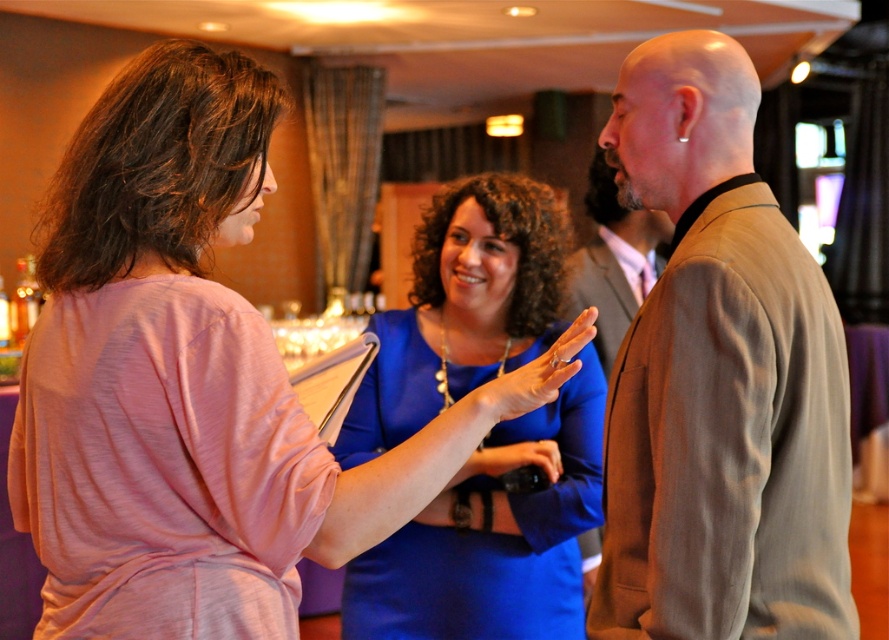
Who is shorter, matte pink hand at center or matte black camera at center?

With less height is matte black camera at center.

Which is more to the left, matte pink hand at center or matte black camera at center?

matte pink hand at center

Identify the location of matte pink hand at center. (535, 376).

Which is behind, point (714, 230) or point (527, 456)?

The point (527, 456) is more distant.

Is light brown jacket at center wider than matte black camera at center?

Correct, the width of light brown jacket at center exceeds that of matte black camera at center.

Between point (694, 292) and point (491, 458), which one is positioned behind?

The point (491, 458) is behind.

Locate an element on the screen. light brown jacket at center is located at coordinates (719, 380).

Does pink fabric dress at center have a larger size compared to brown textured suit at center?

No, pink fabric dress at center is not bigger than brown textured suit at center.

You are a GUI agent. You are given a task and a screenshot of the screen. Output one action in this format:
    pyautogui.click(x=<x>, y=<y>)
    Task: Click on the pink fabric dress at center
    
    Given the screenshot: What is the action you would take?
    pyautogui.click(x=182, y=381)

In order to click on pink fabric dress at center in this screenshot , I will do `click(182, 381)`.